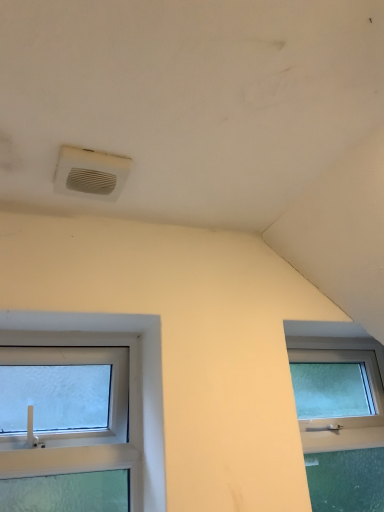
Question: From the image's perspective, relative to clear glass window at lower left, is white plastic air conditioning at upper center above or below?

Choices:
 (A) below
 (B) above

Answer: (B)

Question: From a real-world perspective, relative to clear glass window at lower left, is white plastic air conditioning at upper center vertically above or below?

Choices:
 (A) below
 (B) above

Answer: (B)

Question: Looking at their shapes, would you say white plastic air conditioning at upper center is wider or thinner than clear glass window at lower left?

Choices:
 (A) wide
 (B) thin

Answer: (A)

Question: In terms of height, does clear glass window at lower left look taller or shorter compared to white plastic air conditioning at upper center?

Choices:
 (A) short
 (B) tall

Answer: (B)

Question: In terms of width, does clear glass window at lower left look wider or thinner when compared to white plastic air conditioning at upper center?

Choices:
 (A) wide
 (B) thin

Answer: (B)

Question: From the image's perspective, relative to white plastic air conditioning at upper center, is clear glass window at lower left above or below?

Choices:
 (A) below
 (B) above

Answer: (A)

Question: Considering the positions of clear glass window at lower left and white plastic air conditioning at upper center in the image, is clear glass window at lower left bigger or smaller than white plastic air conditioning at upper center?

Choices:
 (A) big
 (B) small

Answer: (A)